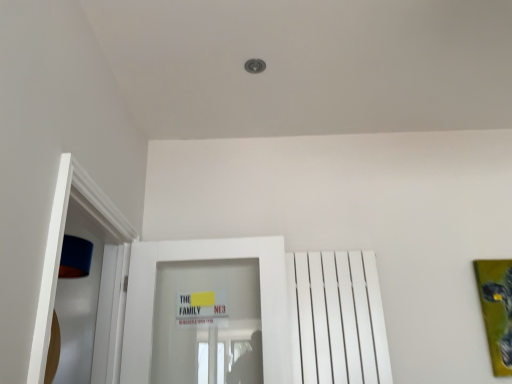
Question: Is white glossy door at center taller than green matte painting at right?

Choices:
 (A) no
 (B) yes

Answer: (B)

Question: Considering the relative sizes of white glossy door at center and green matte painting at right in the image provided, is white glossy door at center wider than green matte painting at right?

Choices:
 (A) no
 (B) yes

Answer: (B)

Question: From the image's perspective, does white glossy door at center appear higher than green matte painting at right?

Choices:
 (A) yes
 (B) no

Answer: (A)

Question: Is white glossy door at center not close to green matte painting at right?

Choices:
 (A) yes
 (B) no

Answer: (A)

Question: Considering the relative sizes of white glossy door at center and green matte painting at right in the image provided, is white glossy door at center shorter than green matte painting at right?

Choices:
 (A) yes
 (B) no

Answer: (B)

Question: Based on their positions, is white glossy door at center located to the left or right of green matte painting at right?

Choices:
 (A) left
 (B) right

Answer: (A)

Question: From the image's perspective, is white glossy door at center positioned above or below green matte painting at right?

Choices:
 (A) below
 (B) above

Answer: (B)

Question: In terms of width, does white glossy door at center look wider or thinner when compared to green matte painting at right?

Choices:
 (A) thin
 (B) wide

Answer: (B)

Question: Is white glossy door at center taller or shorter than green matte painting at right?

Choices:
 (A) tall
 (B) short

Answer: (A)

Question: Is white matte radiator at right in front of or behind white glossy door at center in the image?

Choices:
 (A) behind
 (B) front

Answer: (A)

Question: Considering the positions of white matte radiator at right and white glossy door at center in the image, is white matte radiator at right taller or shorter than white glossy door at center?

Choices:
 (A) tall
 (B) short

Answer: (B)

Question: Considering the positions of point (367, 369) and point (270, 382), is point (367, 369) closer or farther from the camera than point (270, 382)?

Choices:
 (A) closer
 (B) farther

Answer: (B)

Question: Is white matte radiator at right spatially inside white glossy door at center, or outside of it?

Choices:
 (A) outside
 (B) inside

Answer: (A)

Question: Considering the relative positions of white glossy door at center and white matte radiator at right in the image provided, is white glossy door at center to the left or to the right of white matte radiator at right?

Choices:
 (A) left
 (B) right

Answer: (A)

Question: Looking at the image, does white glossy door at center seem bigger or smaller compared to white matte radiator at right?

Choices:
 (A) big
 (B) small

Answer: (A)